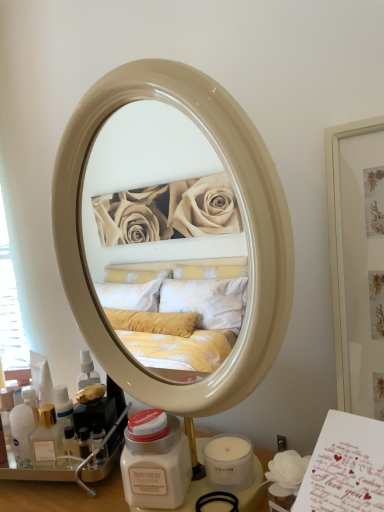
Question: Is matte white jar at lower center facing towards translucent plastic bottle at lower left?

Choices:
 (A) yes
 (B) no

Answer: (B)

Question: Is matte white jar at lower center shorter than translucent plastic bottle at lower left?

Choices:
 (A) yes
 (B) no

Answer: (B)

Question: Can you confirm if matte white jar at lower center is smaller than translucent plastic bottle at lower left?

Choices:
 (A) no
 (B) yes

Answer: (A)

Question: Is matte white jar at lower center directly adjacent to translucent plastic bottle at lower left?

Choices:
 (A) yes
 (B) no

Answer: (B)

Question: Is matte white jar at lower center wider than translucent plastic bottle at lower left?

Choices:
 (A) no
 (B) yes

Answer: (B)

Question: From a real-world perspective, is matte white jar at lower center below translucent plastic bottle at lower left?

Choices:
 (A) no
 (B) yes

Answer: (A)

Question: Is translucent plastic bottle at lower left taller than matte white jar at lower center?

Choices:
 (A) no
 (B) yes

Answer: (A)

Question: Does translucent plastic bottle at lower left lie in front of matte white jar at lower center?

Choices:
 (A) yes
 (B) no

Answer: (B)

Question: From a real-world perspective, is translucent plastic bottle at lower left located higher than matte white jar at lower center?

Choices:
 (A) no
 (B) yes

Answer: (A)

Question: Could you tell me if translucent plastic bottle at lower left is facing matte white jar at lower center?

Choices:
 (A) yes
 (B) no

Answer: (B)

Question: Can you confirm if translucent plastic bottle at lower left is positioned to the right of matte white jar at lower center?

Choices:
 (A) yes
 (B) no

Answer: (B)

Question: Considering the relative sizes of translucent plastic bottle at lower left and matte white jar at lower center in the image provided, is translucent plastic bottle at lower left shorter than matte white jar at lower center?

Choices:
 (A) yes
 (B) no

Answer: (A)

Question: From the image's perspective, relative to matte white jar at lower center, is translucent plastic bottle at lower left above or below?

Choices:
 (A) above
 (B) below

Answer: (B)